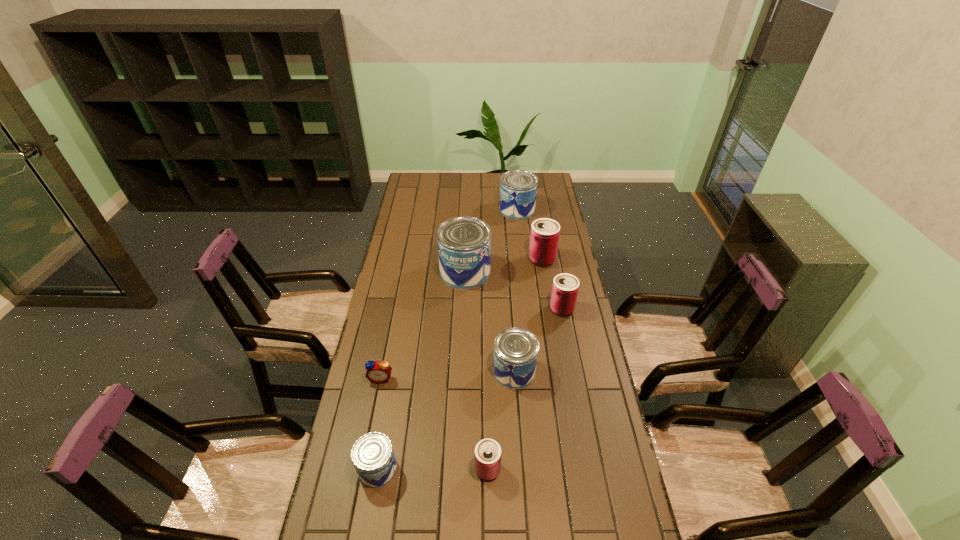
Where is `the nearest pink can`? This screenshot has height=540, width=960. the nearest pink can is located at coordinates coord(487,456).

The width and height of the screenshot is (960, 540). I want to click on the smallest pink can, so click(x=487, y=456).

Find the location of `the leftmost can`. the leftmost can is located at coordinates (372, 454).

Where is `the leftmost blue can`? the leftmost blue can is located at coordinates (372, 454).

What are the coordinates of `free space located on the front label of the tallest object` in the screenshot? It's located at tap(549, 272).

Identify the location of vacant space located 0.280m on the front of the biggest pink can. (551, 316).

Find the location of a particular element. This screenshot has width=960, height=540. vacant region located 0.350m on the front label of the farthest can is located at coordinates (430, 210).

Where is `free point located on the front label of the farthest can`? free point located on the front label of the farthest can is located at coordinates (473, 210).

The image size is (960, 540). Identify the location of vacant space positioned on the front label of the farthest can. (447, 210).

Image resolution: width=960 pixels, height=540 pixels. In order to click on free space located 0.190m on the front of the second smallest pink can in this screenshot , I will do `click(571, 358)`.